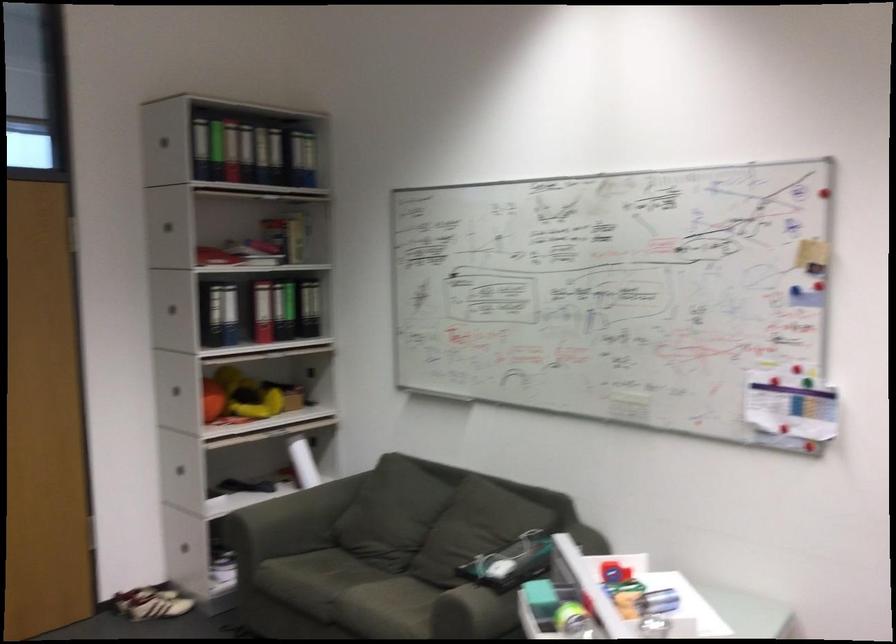
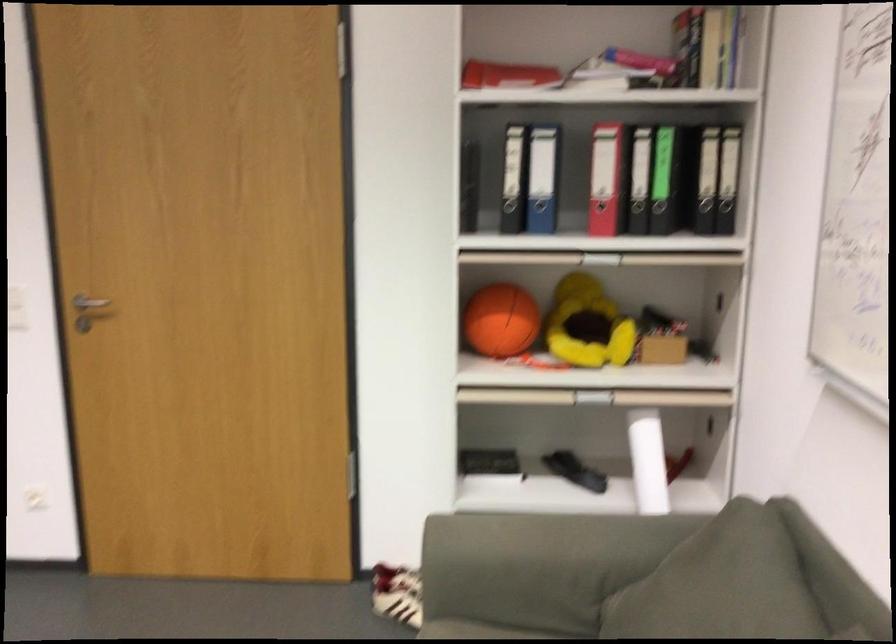
In the second image, find the point that corresponds to [286,299] in the first image.

(662, 140)